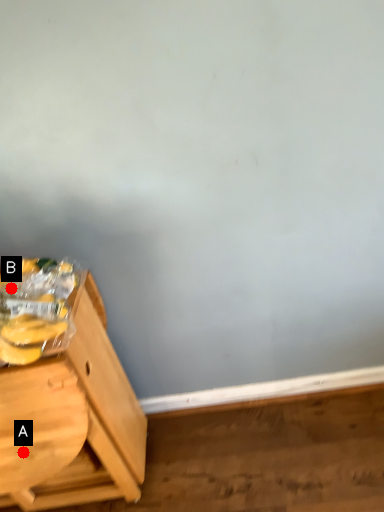
Question: Two points are circled on the image, labeled by A and B beside each circle. Which point is farther from the camera taking this photo?

Choices:
 (A) A is further
 (B) B is further

Answer: (A)